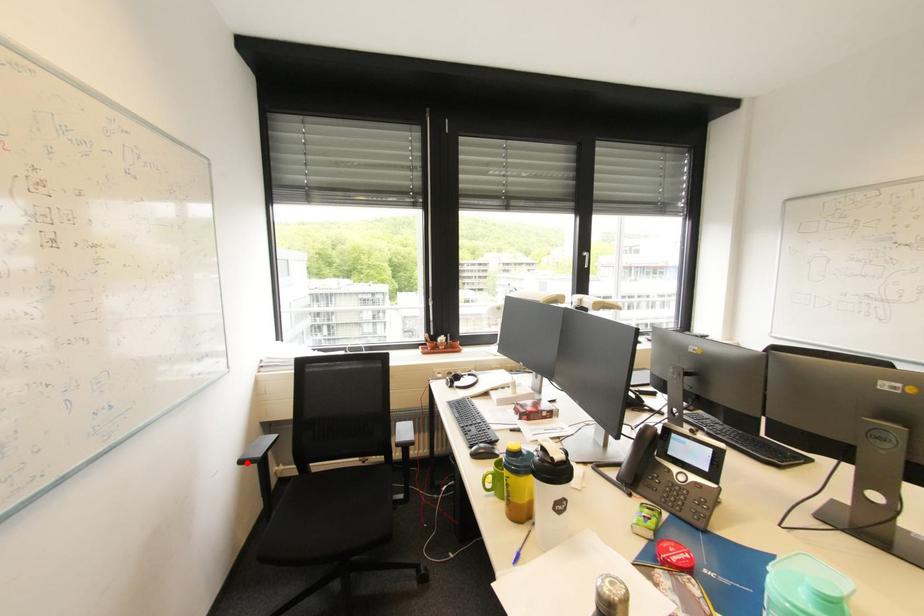
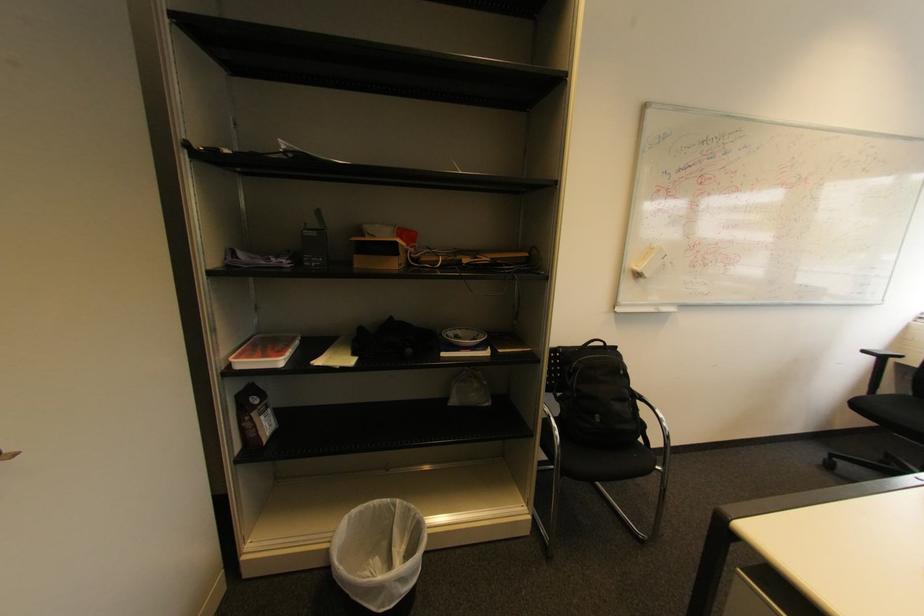
Locate, in the second image, the point that corresponds to the highlighted location in the first image.

(869, 352)